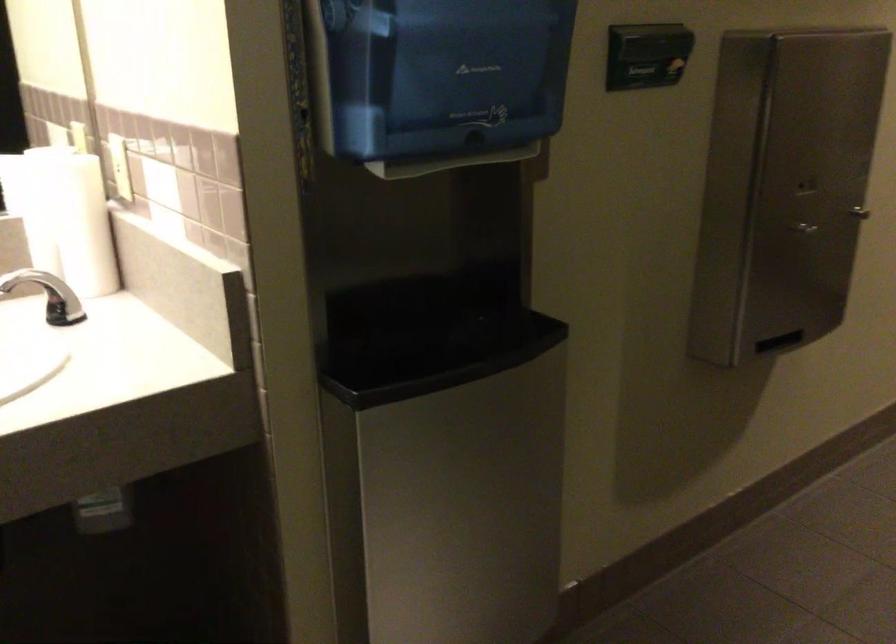
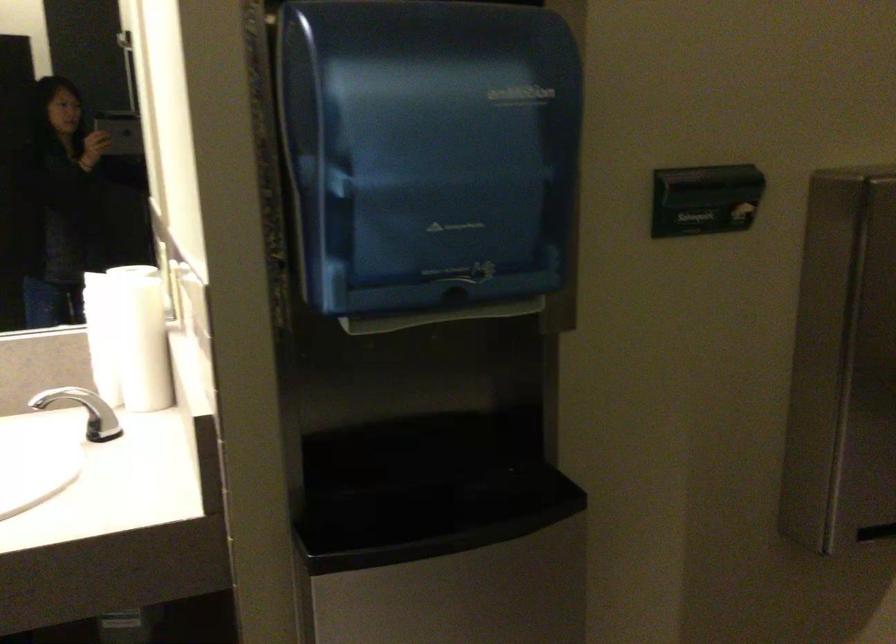
The point at (71, 218) is marked in the first image. Where is the corresponding point in the second image?

(128, 337)